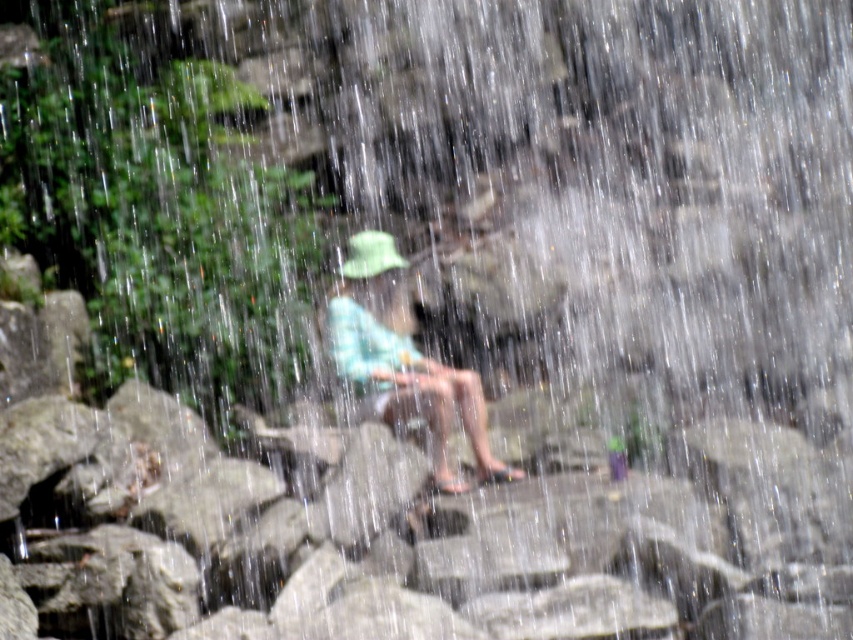
Question: Which object appears closest to the camera in this image?

Choices:
 (A) green fabric hat at center
 (B) light blue fabric hat at center

Answer: (B)

Question: From the image, what is the correct spatial relationship of light blue fabric hat at center in relation to green fabric hat at center?

Choices:
 (A) left
 (B) right

Answer: (B)

Question: Does light blue fabric hat at center have a lesser width compared to green fabric hat at center?

Choices:
 (A) no
 (B) yes

Answer: (A)

Question: Among these points, which one is nearest to the camera?

Choices:
 (A) (352, 236)
 (B) (379, 240)

Answer: (B)

Question: Can you confirm if light blue fabric hat at center is bigger than green fabric hat at center?

Choices:
 (A) yes
 (B) no

Answer: (A)